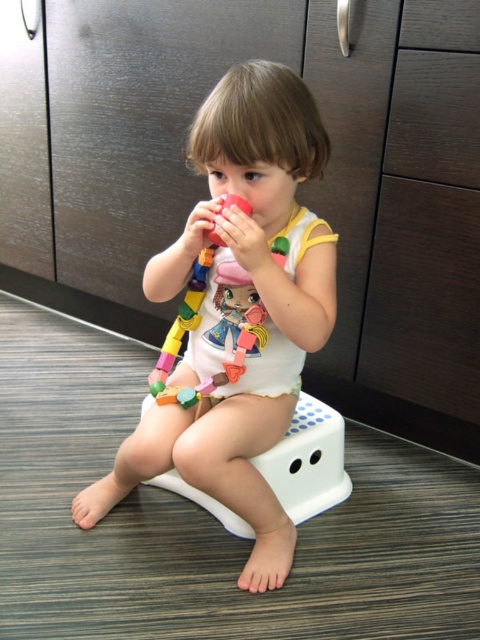
You are a parent trying to clean up the play area. You see the white matte onesie at center and the wooden blocks at center. Which item is closer to the floor?

The white matte onesie at center is closer to the floor because it is positioned under the wooden blocks at center.